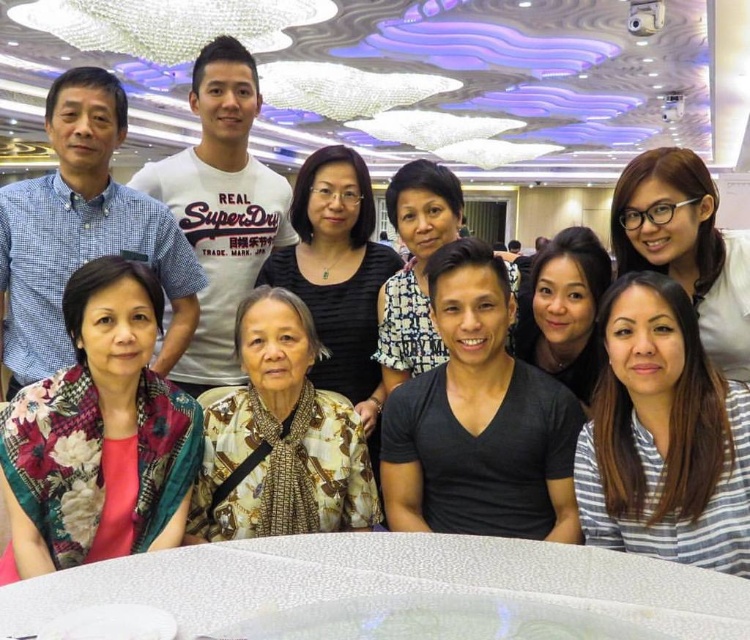
Is point (686, 577) positioned after point (39, 538)?

No, it is not.

Is point (544, 550) farther from viewer compared to point (72, 419)?

No, (544, 550) is closer to viewer.

Identify the location of white textured table at center. This screenshot has height=640, width=750. (386, 580).

Who is shorter, floral-patterned blouse at lower left or printed fabric blouse at center?

printed fabric blouse at center

Is floral-patterned blouse at lower left smaller than printed fabric blouse at center?

No.

Is point (9, 355) less distant than point (374, 500)?

No.

Locate an element on the screen. floral-patterned blouse at lower left is located at coordinates (82, 230).

Does black matte shirt at center have a greater height compared to patterned fabric scarf at center?

No.

Is black matte shirt at center shorter than patterned fabric scarf at center?

Correct, black matte shirt at center is not as tall as patterned fabric scarf at center.

Is point (464, 397) behind point (346, 172)?

That is False.

You are a GUI agent. You are given a task and a screenshot of the screen. Output one action in this format:
    pyautogui.click(x=<x>, y=<y>)
    Task: Click on the black matte shirt at center
    Image resolution: width=750 pixels, height=640 pixels.
    Given the screenshot: What is the action you would take?
    pyautogui.click(x=478, y=420)